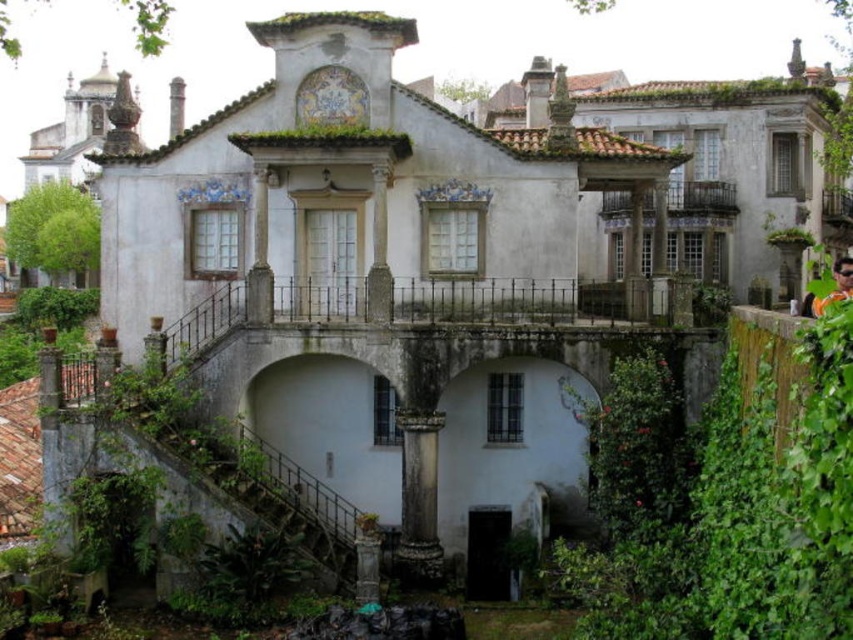
You are standing in front of a historic building complex. You need to locate the white stucco mansion at center. According to the map coordinates, where exactly is it positioned?

The white stucco mansion at center is located at the 2D coordinates point (730, 164).

You are a window cleaner who needs to reach the green leafy plant at upper right and the wooden balcony at upper right. Which object requires you to climb higher?

The green leafy plant at upper right requires climbing higher since it is much taller than the wooden balcony at upper right.

You are a visitor standing in front of the historic building. You notice the green leafy plant at upper right and the wooden balcony at upper right. Which object is positioned more to the left side of the building?

The green leafy plant at upper right is positioned more to the left side of the building compared to the wooden balcony at upper right.